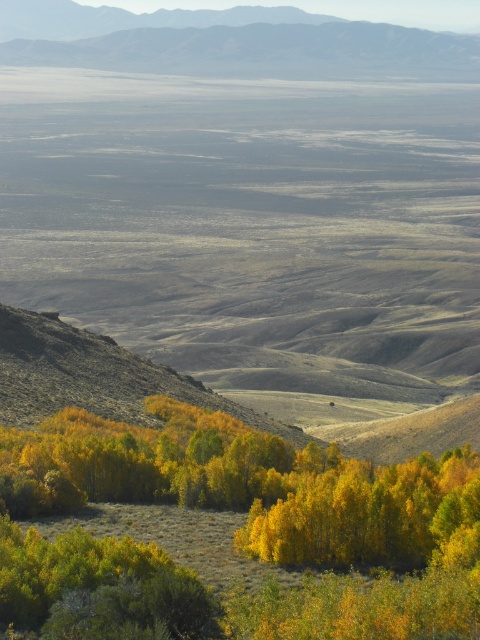
Between yellow leafy trees at lower left and rugged brown mountain at upper center, which one has less height?

With less height is yellow leafy trees at lower left.

What do you see at coordinates (253, 486) in the screenshot?
I see `yellow leafy trees at lower left` at bounding box center [253, 486].

Does point (458, 582) come farther from viewer compared to point (239, 24)?

No, (458, 582) is closer to viewer.

You are a GUI agent. You are given a task and a screenshot of the screen. Output one action in this format:
    pyautogui.click(x=<x>, y=<y>)
    Task: Click on the yellow leafy trees at lower left
    The image size is (480, 640).
    Given the screenshot: What is the action you would take?
    pyautogui.click(x=253, y=486)